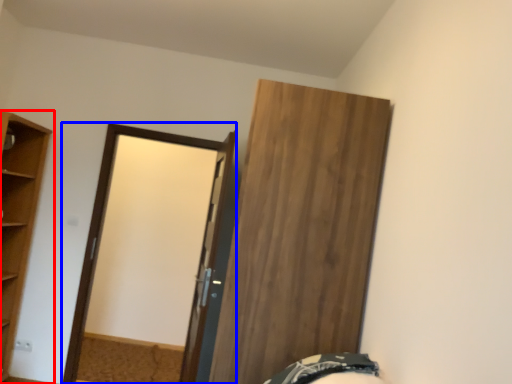
Question: Which point is closer to the camera, cupboard (highlighted by a red box) or screen door (highlighted by a blue box)?

Choices:
 (A) cupboard
 (B) screen door

Answer: (A)